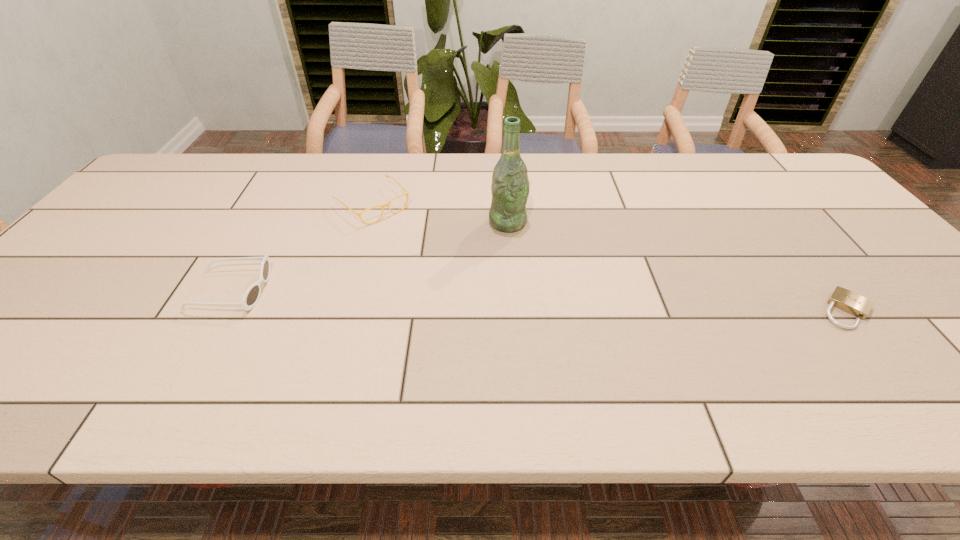
At what (x,y) coordinates should I click in order to perform the action: click on blank area located on the surface of the beer bottle. Please return your answer as a coordinate pair (x, y). The height and width of the screenshot is (540, 960). Looking at the image, I should click on (526, 244).

What are the coordinates of `vacant position located in front of the lenses of the second object from left to right` in the screenshot? It's located at (441, 266).

At what (x,y) coordinates should I click in order to perform the action: click on vacant space located in front of the lenses of the second object from left to right. Please return your answer as a coordinate pair (x, y). Looking at the image, I should click on (404, 233).

This screenshot has width=960, height=540. In order to click on blank area located in front of the lenses of the second object from left to right in this screenshot , I will do `click(458, 281)`.

What are the coordinates of `object that is at the far edge` in the screenshot? It's located at (386, 204).

Locate an element on the screen. This screenshot has width=960, height=540. object present at the near edge is located at coordinates point(844,299).

This screenshot has height=540, width=960. Identify the location of object that is at the right edge. (844, 299).

You are a GUI agent. You are given a task and a screenshot of the screen. Output one action in this format:
    pyautogui.click(x=<x>, y=<y>)
    Task: Click on the object positioned at the near right corner
    
    Given the screenshot: What is the action you would take?
    pyautogui.click(x=844, y=299)

This screenshot has height=540, width=960. Identify the location of vacant space at the far edge. click(x=452, y=159).

Identify the location of vacant space at the left edge of the desktop. (144, 225).